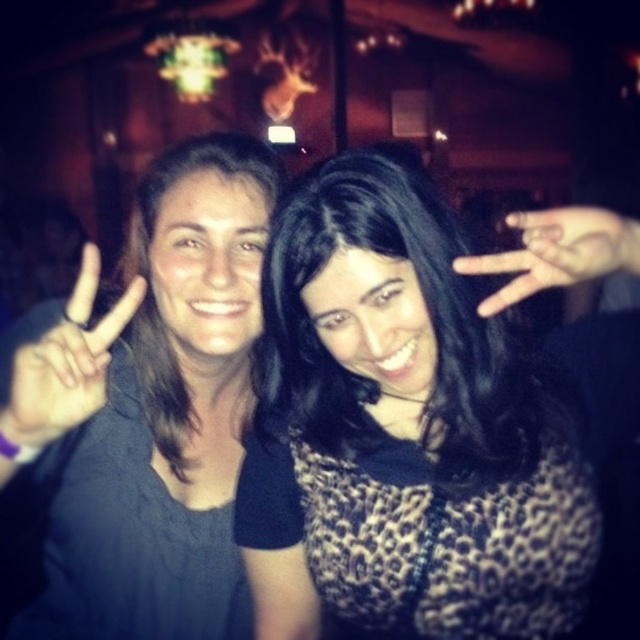
Question: Which object is positioned closest to the matte black hand at center?

Choices:
 (A) leopard print top at center
 (B) black matte hand at left

Answer: (A)

Question: Can you confirm if dark gray sweater at left is positioned to the left of black matte hand at left?

Choices:
 (A) no
 (B) yes

Answer: (B)

Question: Which object is positioned farthest from the dark gray sweater at left?

Choices:
 (A) black matte hand at left
 (B) matte black hand at center
 (C) leopard print top at center

Answer: (B)

Question: Can you confirm if black matte hand at left is smaller than matte black hand at center?

Choices:
 (A) no
 (B) yes

Answer: (A)

Question: Is the position of leopard print top at center more distant than that of dark gray sweater at left?

Choices:
 (A) no
 (B) yes

Answer: (B)

Question: Which point is closer to the camera?

Choices:
 (A) (528, 412)
 (B) (566, 234)

Answer: (B)